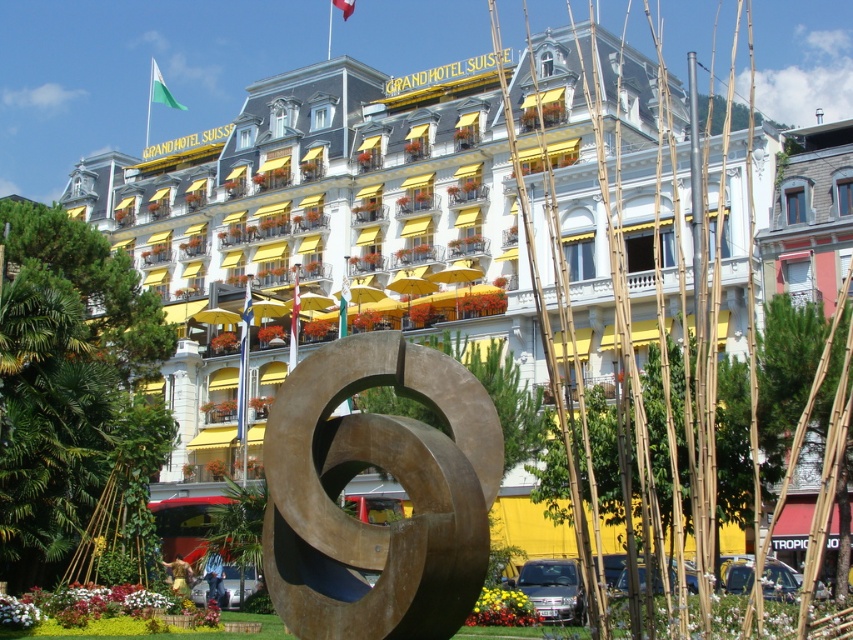
Question: Which object is closer to the camera taking this photo?

Choices:
 (A) white stone building at center
 (B) bronze sculpture at center

Answer: (B)

Question: Is white stone building at center positioned at the back of bronze sculpture at center?

Choices:
 (A) yes
 (B) no

Answer: (A)

Question: Does white stone building at center appear on the right side of bronze sculpture at center?

Choices:
 (A) yes
 (B) no

Answer: (B)

Question: Among these objects, which one is nearest to the camera?

Choices:
 (A) bronze sculpture at center
 (B) white stone building at center

Answer: (A)

Question: Can you confirm if white stone building at center is positioned above bronze sculpture at center?

Choices:
 (A) yes
 (B) no

Answer: (A)